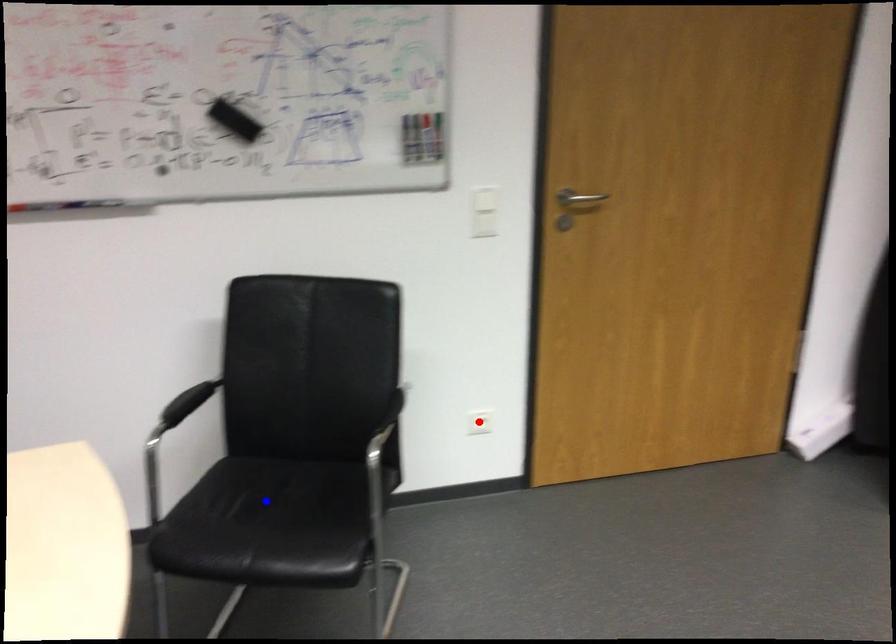
Question: In the image, two points are highlighted. Which point is nearer to the camera? Reply with the corresponding letter.

Choices:
 (A) blue point
 (B) red point

Answer: (A)